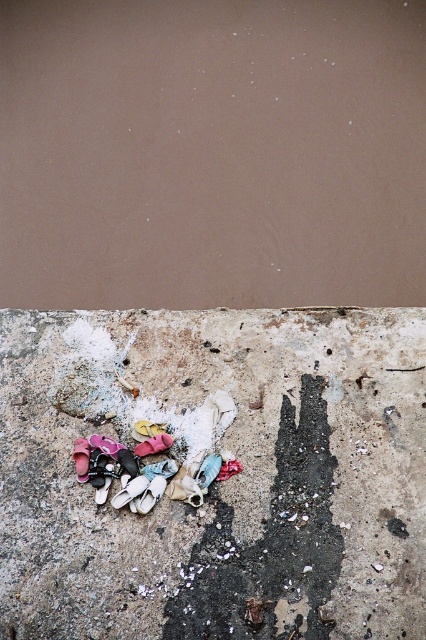
Question: Can you confirm if dirty concrete shoes at bottom center is wider than white fabric shoe at lower left?

Choices:
 (A) yes
 (B) no

Answer: (A)

Question: Which object is positioned farthest from the white matte shoe at lower left?

Choices:
 (A) dirty concrete shoes at bottom center
 (B) pink fabric shoe at lower center
 (C) white fabric shoe at lower left

Answer: (A)

Question: Among these points, which one is nearest to the camera?

Choices:
 (A) (120, 499)
 (B) (160, 451)
 (C) (37, 349)

Answer: (A)

Question: Is dirty concrete shoes at bottom center to the right of white matte shoe at lower left from the viewer's perspective?

Choices:
 (A) no
 (B) yes

Answer: (B)

Question: Which object appears farthest from the camera in this image?

Choices:
 (A) pink fabric shoe at lower center
 (B) white fabric shoe at lower left

Answer: (A)

Question: From the image, what is the correct spatial relationship of dirty concrete shoes at bottom center in relation to white fabric shoe at lower left?

Choices:
 (A) right
 (B) left

Answer: (A)